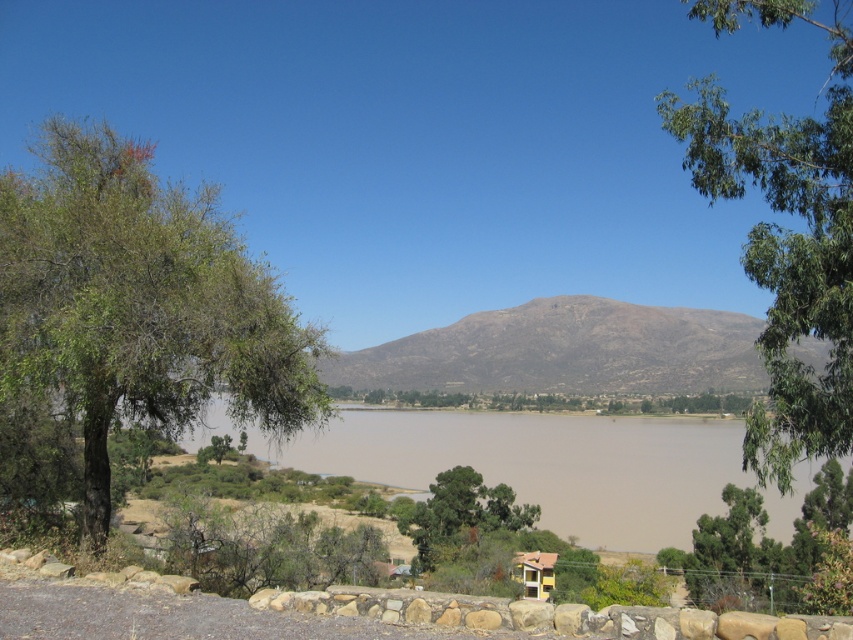
Question: Considering the real-world distances, which object is farthest from the brown/drymountain at center?

Choices:
 (A) brown sedimentary water at center
 (B) yellow matte gazebo at lower center
 (C) green leafy tree at upper right
 (D) green leafy tree at left

Answer: (D)

Question: Can you confirm if green leafy tree at upper right is smaller than brown/drymountain at center?

Choices:
 (A) yes
 (B) no

Answer: (A)

Question: Which object is positioned farthest from the green leafy tree at upper right?

Choices:
 (A) brown sedimentary water at center
 (B) green leafy tree at left
 (C) brown/drymountain at center

Answer: (C)

Question: Estimate the real-world distances between objects in this image. Which object is farther from the brown sedimentary water at center?

Choices:
 (A) green leafy tree at upper right
 (B) yellow matte gazebo at lower center

Answer: (A)

Question: Is the position of green leafy tree at upper right less distant than that of brown sedimentary water at center?

Choices:
 (A) yes
 (B) no

Answer: (A)

Question: Is green leafy tree at left smaller than brown/drymountain at center?

Choices:
 (A) no
 (B) yes

Answer: (B)